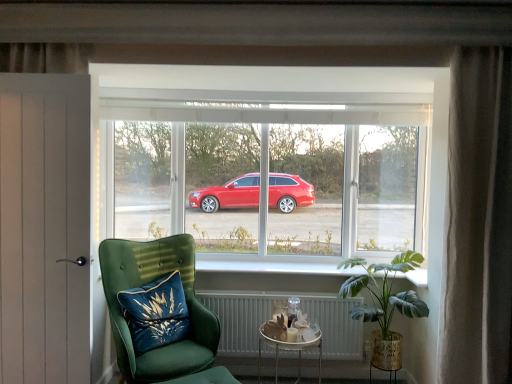
What are the coordinates of `blank space situated above metallic silver tray at lower center (from a real-world perspective)` in the screenshot? It's located at (292, 324).